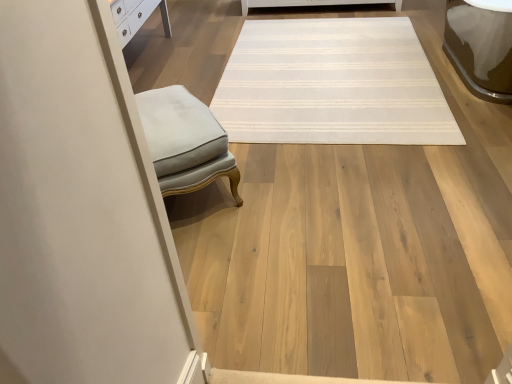
What do you see at coordinates (332, 85) in the screenshot? I see `white striped rug at center` at bounding box center [332, 85].

The width and height of the screenshot is (512, 384). Find the location of `white striped rug at center`. white striped rug at center is located at coordinates (332, 85).

The width and height of the screenshot is (512, 384). What do you see at coordinates (185, 142) in the screenshot? I see `light gray fabric ottoman at left` at bounding box center [185, 142].

Identify the location of light gray fabric ottoman at left. This screenshot has height=384, width=512. tap(185, 142).

Identify the location of white striped rug at center. This screenshot has width=512, height=384. (332, 85).

Visually, is white striped rug at center positioned to the left or to the right of light gray fabric ottoman at left?

white striped rug at center is positioned on light gray fabric ottoman at left's right side.

Is white striped rug at center behind light gray fabric ottoman at left?

Yes.

Is point (364, 112) less distant than point (141, 105)?

No, (364, 112) is further to viewer.

From the image's perspective, does white striped rug at center appear higher than light gray fabric ottoman at left?

Correct, white striped rug at center appears higher than light gray fabric ottoman at left in the image.

From a real-world perspective, which object stands above the other?

light gray fabric ottoman at left, from a real-world perspective.

Can you confirm if white striped rug at center is thinner than light gray fabric ottoman at left?

Incorrect, the width of white striped rug at center is not less than that of light gray fabric ottoman at left.

In terms of height, does white striped rug at center look taller or shorter compared to light gray fabric ottoman at left?

Considering their sizes, white striped rug at center has less height than light gray fabric ottoman at left.

In the scene shown: Who is bigger, white striped rug at center or light gray fabric ottoman at left?

white striped rug at center is bigger.

Is light gray fabric ottoman at left a part of white striped rug at center?

No.

Does white striped rug at center touch light gray fabric ottoman at left?

No, white striped rug at center is not with light gray fabric ottoman at left.

Is white striped rug at center looking in the opposite direction of light gray fabric ottoman at left?

No.

How different are the orientations of white striped rug at center and light gray fabric ottoman at left in degrees?

The facing directions of white striped rug at center and light gray fabric ottoman at left are 124 degrees apart.

The height and width of the screenshot is (384, 512). I want to click on mat below the light gray fabric ottoman at left (from a real-world perspective), so click(x=332, y=85).

Considering the relative positions of light gray fabric ottoman at left and white striped rug at center in the image provided, is light gray fabric ottoman at left to the left of white striped rug at center from the viewer's perspective?

Yes, light gray fabric ottoman at left is to the left of white striped rug at center.

Is the position of light gray fabric ottoman at left more distant than that of white striped rug at center?

That is False.

Is point (179, 89) closer or farther from the camera than point (403, 55)?

Point (179, 89) appears to be closer to the viewer than point (403, 55).

From the image's perspective, relative to white striped rug at center, is light gray fabric ottoman at left above or below?

Clearly, from the image's perspective, light gray fabric ottoman at left is below white striped rug at center.

From a real-world perspective, is light gray fabric ottoman at left above or below white striped rug at center?

light gray fabric ottoman at left is situated higher than white striped rug at center in the real world.

Which of these two, light gray fabric ottoman at left or white striped rug at center, is wider?

Wider between the two is white striped rug at center.

Which of these two, light gray fabric ottoman at left or white striped rug at center, stands taller?

With more height is light gray fabric ottoman at left.

Who is bigger, light gray fabric ottoman at left or white striped rug at center?

white striped rug at center.

Is light gray fabric ottoman at left positioned beyond the bounds of white striped rug at center?

Yes.

Looking at this image, is light gray fabric ottoman at left next to white striped rug at center?

There is a gap between light gray fabric ottoman at left and white striped rug at center.

Is white striped rug at center at the back of light gray fabric ottoman at left?

light gray fabric ottoman at left does not have its back to white striped rug at center.

Locate an element on the screen. mat on the right side of light gray fabric ottoman at left is located at coordinates (332, 85).

Locate an element on the screen. mat below the light gray fabric ottoman at left (from a real-world perspective) is located at coordinates (332, 85).

At what (x,y) coordinates should I click in order to perform the action: click on mat that is above the light gray fabric ottoman at left (from the image's perspective). Please return your answer as a coordinate pair (x, y). Image resolution: width=512 pixels, height=384 pixels. Looking at the image, I should click on (332, 85).